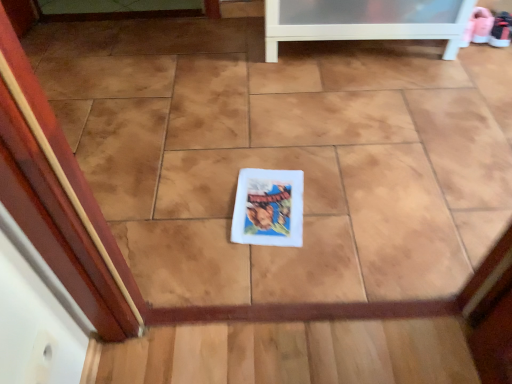
Question: Should I look upward or downward to see white matte book cover at center?

Choices:
 (A) up
 (B) down

Answer: (B)